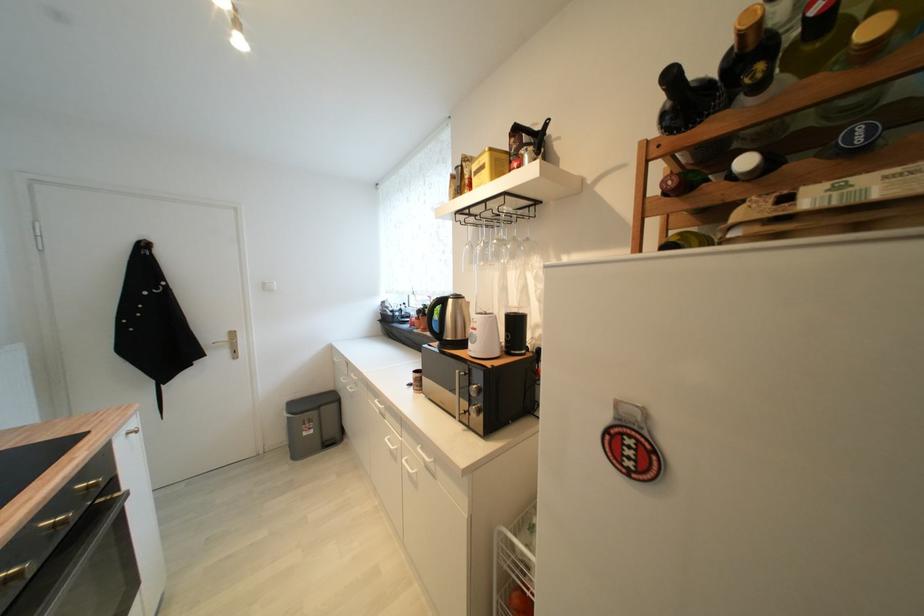
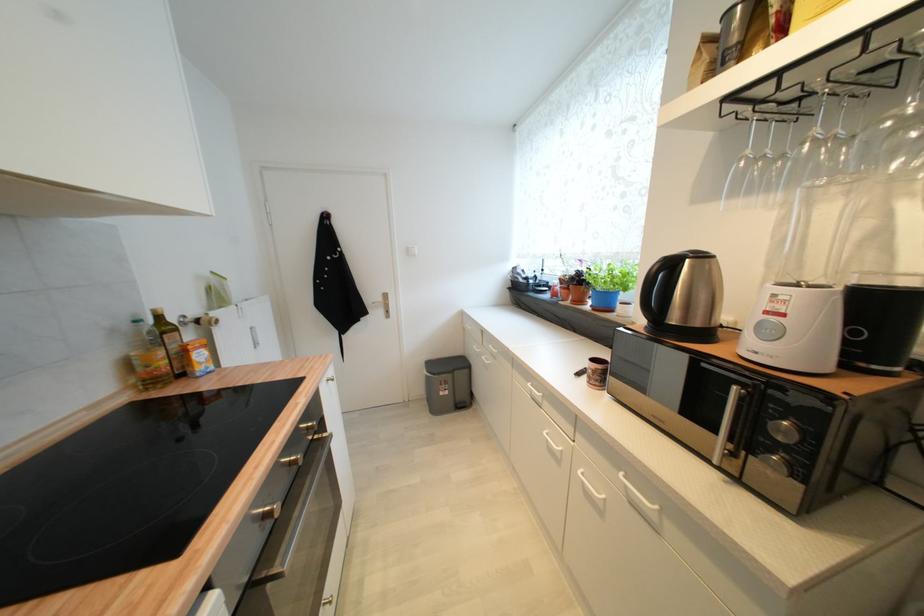
The images are taken continuously from a first-person perspective. In which direction are you moving?

The cameraman walked toward left, forward.